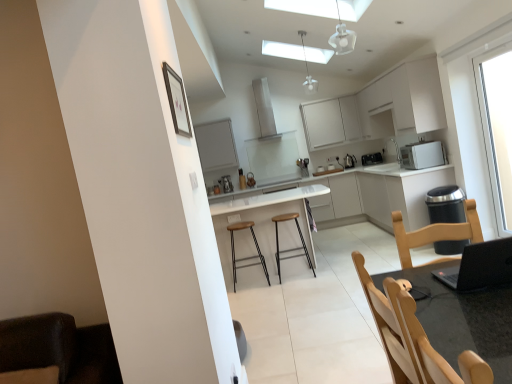
Question: Considering the positions of point (231, 236) and point (254, 104), is point (231, 236) closer or farther from the camera than point (254, 104)?

Choices:
 (A) farther
 (B) closer

Answer: (B)

Question: From the image's perspective, is brown leather bar stool at center, marked as the 2th bar stool in a right-to-left arrangement, located above or below white matte exhaust hood at upper center?

Choices:
 (A) above
 (B) below

Answer: (B)

Question: Estimate the real-world distances between objects in this image. Which object is farther from the white matte cabinet at upper center?

Choices:
 (A) black matte laptop at lower right
 (B) metallic silver bar stool at center, which appears as the 1th bar stool when viewed from the right
 (C) black plastic toaster at upper right, which is the 2th appliance in front-to-back order
 (D) satin silver coffee machine at center
 (E) brown leather bar stool at center, which is the 1th bar stool in left-to-right order

Answer: (A)

Question: Estimate the real-world distances between objects in this image. Which object is closer to the white glossy countertop at center?

Choices:
 (A) brown leather bar stool at center, which is the 1th bar stool in left-to-right order
 (B) clear glass window at upper right
 (C) white matte exhaust hood at upper center
 (D) polished stainless steel kettle at center-right, placed as the third appliance when sorted from front to back
 (E) white glossy bar stools at center

Answer: (D)